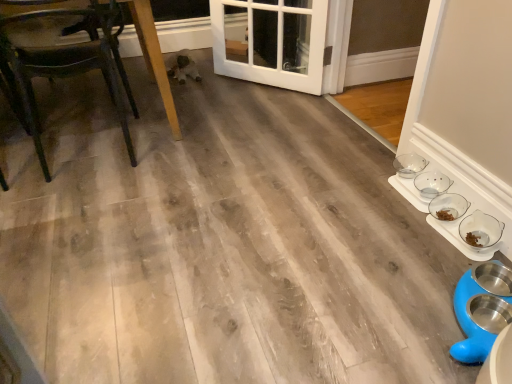
Question: Looking at the image, does wooden chair at left seem bigger or smaller compared to white glossy door at center?

Choices:
 (A) small
 (B) big

Answer: (B)

Question: From a real-world perspective, is wooden chair at left physically located above or below white glossy door at center?

Choices:
 (A) above
 (B) below

Answer: (A)

Question: Estimate the real-world distances between objects in this image. Which object is closer to the clear glass bowl at lower right, which is the first bowl from front to back?

Choices:
 (A) clear glass bowls at right, which is counted as the 1th bowl, starting from the back
 (B) clear glass bowls at lower right, acting as the 2th bowl starting from the back
 (C) wooden chair at left
 (D) white glossy door at center

Answer: (B)

Question: Estimate the real-world distances between objects in this image. Which object is closer to the wooden chair at left?

Choices:
 (A) clear glass bowls at lower right, which is counted as the 2th bowl, starting from the front
 (B) white glossy door at center
 (C) clear glass bowl at lower right, which is the first bowl from front to back
 (D) clear glass bowls at right, which is counted as the 1th bowl, starting from the back

Answer: (B)